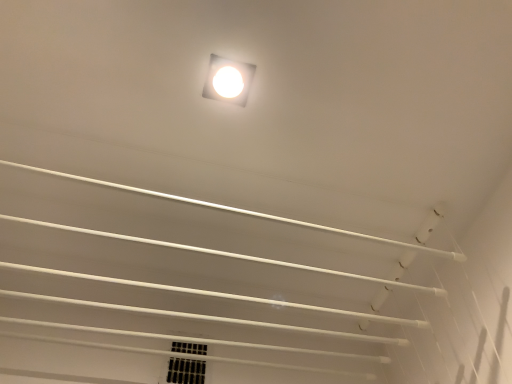
Question: Looking at their shapes, would you say black mesh vent at lower center is wider or thinner than white glossy square lamp at upper center?

Choices:
 (A) wide
 (B) thin

Answer: (B)

Question: From the image's perspective, is black mesh vent at lower center located above or below white glossy square lamp at upper center?

Choices:
 (A) below
 (B) above

Answer: (A)

Question: In the image, is black mesh vent at lower center positioned in front of or behind white glossy square lamp at upper center?

Choices:
 (A) behind
 (B) front

Answer: (A)

Question: Based on their sizes in the image, would you say white glossy square lamp at upper center is bigger or smaller than black mesh vent at lower center?

Choices:
 (A) small
 (B) big

Answer: (A)

Question: Would you say white glossy square lamp at upper center is to the left or to the right of black mesh vent at lower center in the picture?

Choices:
 (A) right
 (B) left

Answer: (A)

Question: Is point (229, 92) positioned closer to the camera than point (179, 377)?

Choices:
 (A) farther
 (B) closer

Answer: (B)

Question: From a real-world perspective, is white glossy square lamp at upper center positioned above or below black mesh vent at lower center?

Choices:
 (A) above
 (B) below

Answer: (A)